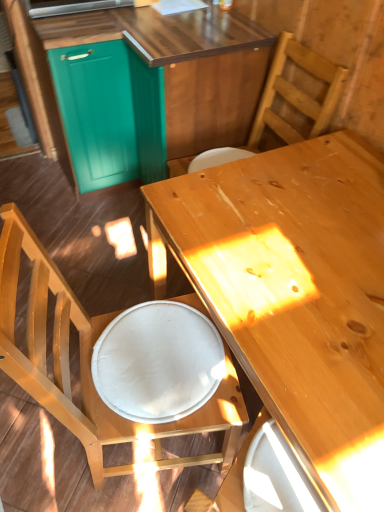
Find the location of `empty space that is ontop of white fabric plate at lower center (from a real-world perspective)`. empty space that is ontop of white fabric plate at lower center (from a real-world perspective) is located at coordinates (162, 350).